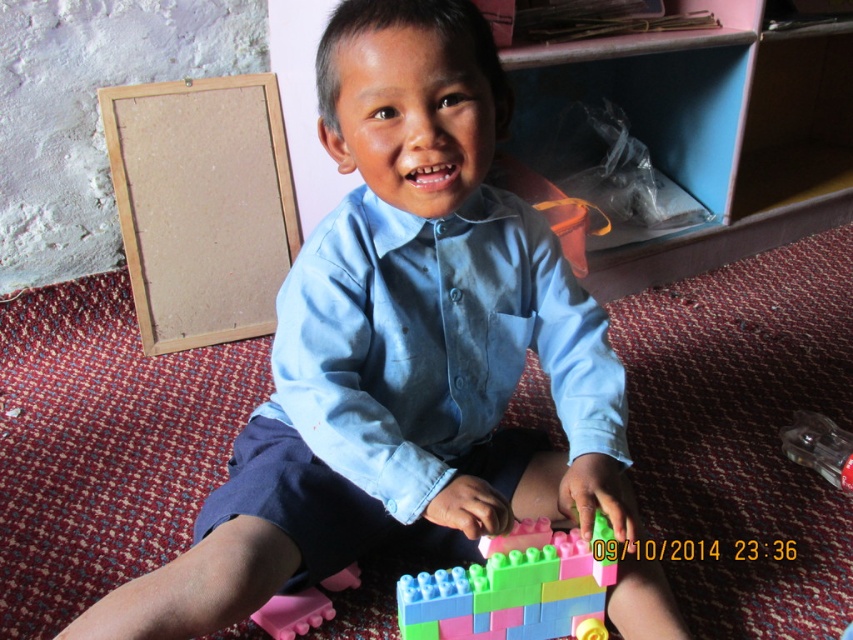
Question: Estimate the real-world distances between objects in this image. Which object is closer to the pink rubber toy at lower left?

Choices:
 (A) bare wood frame at upper left
 (B) pastel plastic blocks at lower center
 (C) light blue cotton shirt at center

Answer: (B)

Question: Can you confirm if light blue cotton shirt at center is positioned to the left of bare wood frame at upper left?

Choices:
 (A) yes
 (B) no

Answer: (B)

Question: Which point is closer to the camera?

Choices:
 (A) coord(302,589)
 (B) coord(477,632)
 (C) coord(177,211)

Answer: (B)

Question: Which object appears closest to the camera in this image?

Choices:
 (A) bare wood frame at upper left
 (B) light blue cotton shirt at center
 (C) pastel plastic blocks at lower center

Answer: (B)

Question: Can you confirm if light blue cotton shirt at center is bigger than pastel plastic blocks at lower center?

Choices:
 (A) yes
 (B) no

Answer: (A)

Question: In this image, where is light blue cotton shirt at center located relative to pastel plastic blocks at lower center?

Choices:
 (A) above
 (B) below

Answer: (A)